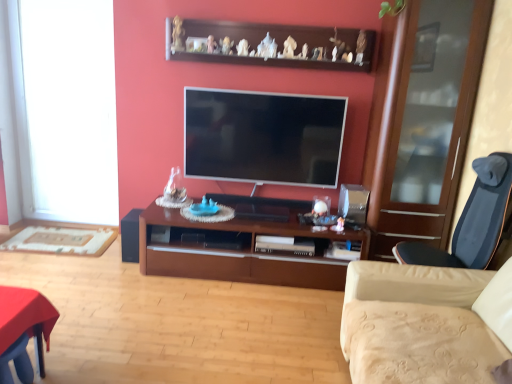
The width and height of the screenshot is (512, 384). Find the location of `free location in front of brown wood cabinet at center`. free location in front of brown wood cabinet at center is located at coordinates (223, 324).